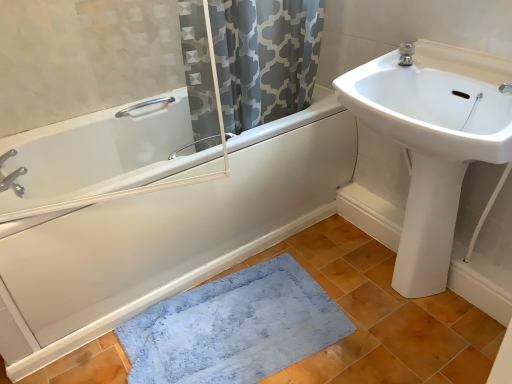
Identify the location of free spot in front of brushed metal faucet at upper left, which is counted as the first tap, starting from the bottom. (14, 206).